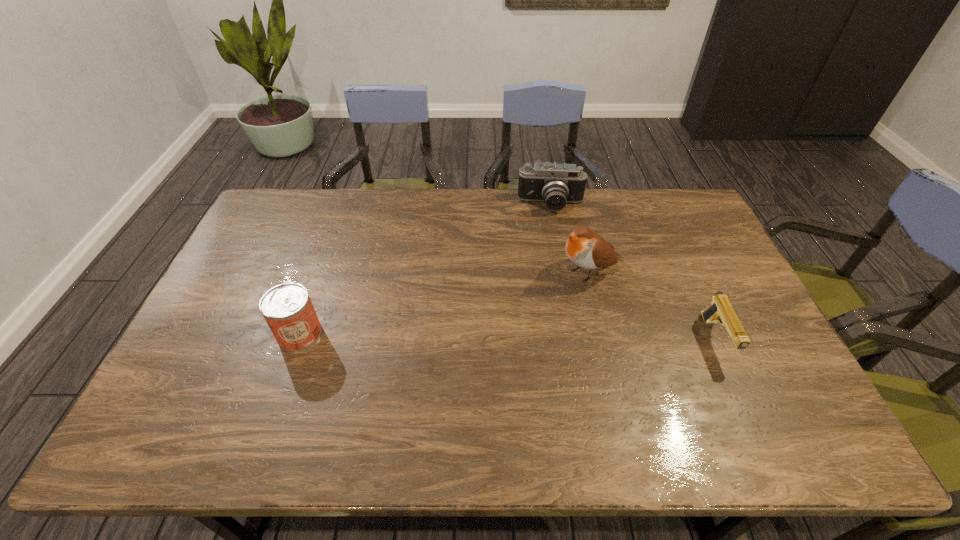
The height and width of the screenshot is (540, 960). I want to click on can, so click(287, 308).

Locate an element on the screen. This screenshot has width=960, height=540. pistol is located at coordinates (720, 310).

You are a GUI agent. You are given a task and a screenshot of the screen. Output one action in this format:
    pyautogui.click(x=<x>, y=<y>)
    Task: Click on the shortest object
    Image resolution: width=960 pixels, height=540 pixels.
    Given the screenshot: What is the action you would take?
    pyautogui.click(x=720, y=310)

At what (x,y) coordinates should I click in order to perform the action: click on the farthest object. Please return your answer as a coordinate pair (x, y). The image size is (960, 540). Looking at the image, I should click on (556, 184).

Where is `the tallest object`? The image size is (960, 540). the tallest object is located at coordinates (586, 249).

Where is `the second farthest object`? This screenshot has height=540, width=960. the second farthest object is located at coordinates (586, 249).

This screenshot has height=540, width=960. Find the location of `vacant region located on the right of the leftmost object`. vacant region located on the right of the leftmost object is located at coordinates (344, 334).

I want to click on vacant area located 0.080m at the barrel of the pistol, so click(741, 397).

At what (x,y) coordinates should I click in order to perform the action: click on vacant space located 0.180m on the front-facing side of the camera. Please return your answer as a coordinate pair (x, y). Image resolution: width=960 pixels, height=540 pixels. Looking at the image, I should click on (553, 252).

Identify the location of vacant space located on the front-facing side of the camera. The image size is (960, 540). (555, 274).